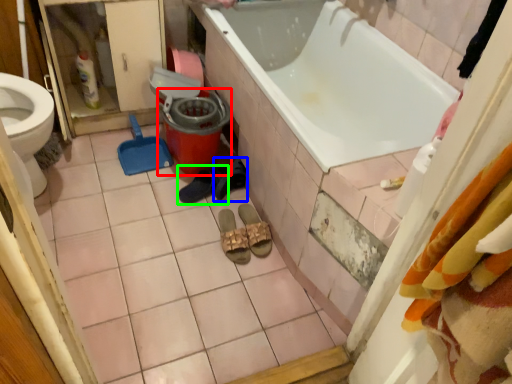
Question: Based on their relative distances, which object is nearer to potty (highlighted by a red box)? Choose from footwear (highlighted by a blue box) and footwear (highlighted by a green box).

Choices:
 (A) footwear
 (B) footwear

Answer: (B)